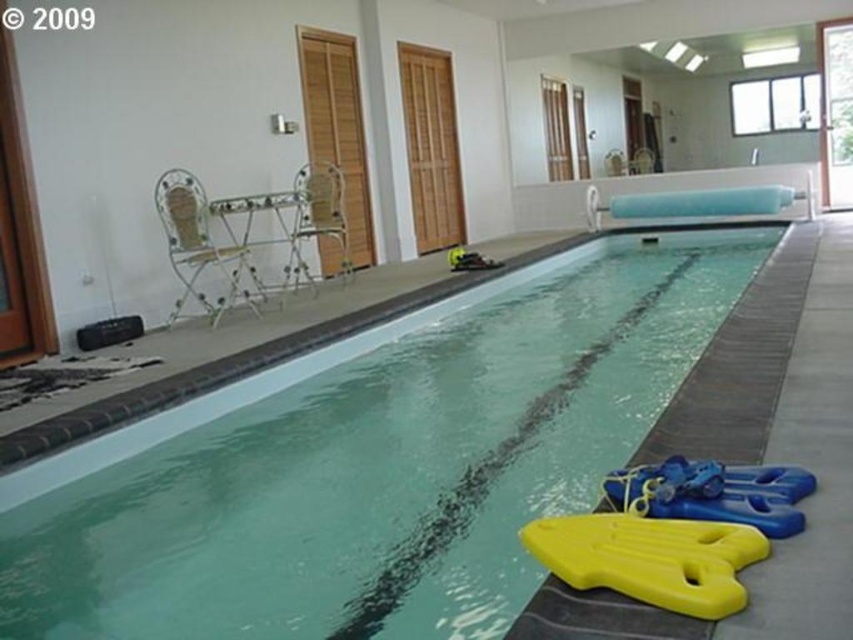
What do you see at coordinates (672, 532) in the screenshot? I see `yellow foam float at lower right` at bounding box center [672, 532].

Is yellow foam float at lower right to the right of yellow plastic float at lower right from the viewer's perspective?

In fact, yellow foam float at lower right is to the left of yellow plastic float at lower right.

Is point (778, 508) farther from camera compared to point (670, 470)?

That is False.

Where is `yellow foam float at lower right`? Image resolution: width=853 pixels, height=640 pixels. yellow foam float at lower right is located at coordinates (672, 532).